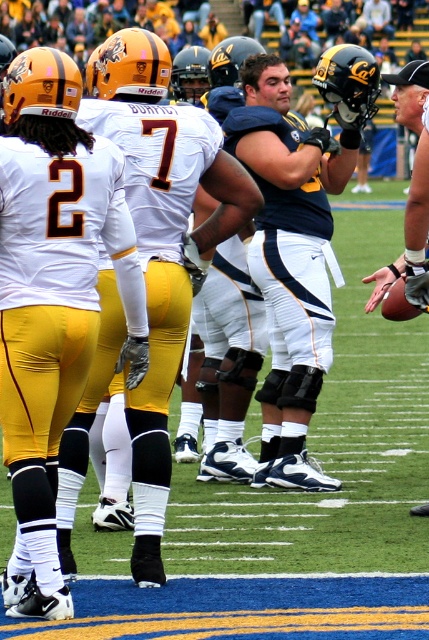
Who is lower down, matte white jersey at left or black matte helmet at upper right?

Positioned lower is matte white jersey at left.

Does matte white jersey at left have a lesser width compared to black matte helmet at upper right?

Indeed, matte white jersey at left has a lesser width compared to black matte helmet at upper right.

Which is behind, point (9, 323) or point (380, 284)?

Point (380, 284)

This screenshot has height=640, width=429. Identify the location of matte white jersey at left. (51, 296).